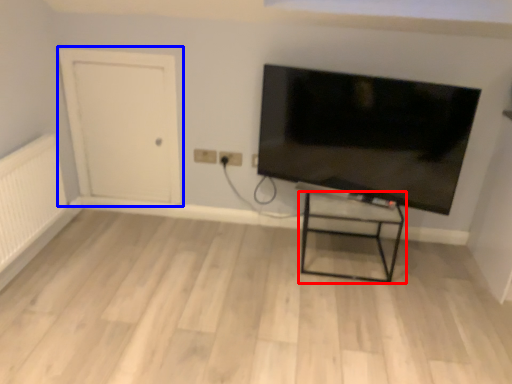
Question: Which object is closer to the camera taking this photo, furniture (highlighted by a red box) or door (highlighted by a blue box)?

Choices:
 (A) furniture
 (B) door

Answer: (A)